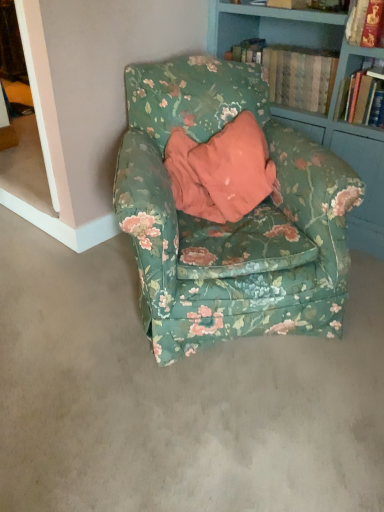
Question: Are hardcover book at upper right, marked as the first book in a left-to-right arrangement, and floral fabric armchair at center located far from each other?

Choices:
 (A) yes
 (B) no

Answer: (B)

Question: Can you confirm if hardcover book at upper right, the 2th book from the right, is thinner than floral fabric armchair at center?

Choices:
 (A) yes
 (B) no

Answer: (A)

Question: Is hardcover book at upper right, the 2th book from the right, oriented towards floral fabric armchair at center?

Choices:
 (A) no
 (B) yes

Answer: (B)

Question: Is hardcover book at upper right, marked as the first book in a left-to-right arrangement, closer to the viewer compared to floral fabric armchair at center?

Choices:
 (A) no
 (B) yes

Answer: (A)

Question: Can you confirm if hardcover book at upper right, the 2th book from the right, is smaller than floral fabric armchair at center?

Choices:
 (A) no
 (B) yes

Answer: (B)

Question: From a real-world perspective, relative to hardcover book at upper right, placed as the 1th book when sorted from right to left, is hardcover book at upper right, marked as the first book in a left-to-right arrangement, vertically above or below?

Choices:
 (A) below
 (B) above

Answer: (A)

Question: Considering the positions of hardcover book at upper right, the 2th book from the right, and hardcover book at upper right, the second book from the left, in the image, is hardcover book at upper right, the 2th book from the right, bigger or smaller than hardcover book at upper right, the second book from the left,?

Choices:
 (A) big
 (B) small

Answer: (A)

Question: Considering the positions of hardcover book at upper right, the 2th book from the right, and hardcover book at upper right, the second book from the left, in the image, is hardcover book at upper right, the 2th book from the right, taller or shorter than hardcover book at upper right, the second book from the left,?

Choices:
 (A) tall
 (B) short

Answer: (B)

Question: From the image's perspective, is hardcover book at upper right, the 2th book from the right, positioned above or below hardcover book at upper right, placed as the 1th book when sorted from right to left?

Choices:
 (A) above
 (B) below

Answer: (A)

Question: From the image's perspective, is floral fabric armchair at center positioned above or below floral fabric armchair at center?

Choices:
 (A) below
 (B) above

Answer: (A)

Question: Is floral fabric armchair at center situated inside floral fabric armchair at center or outside?

Choices:
 (A) outside
 (B) inside

Answer: (A)

Question: In terms of height, does floral fabric armchair at center look taller or shorter compared to floral fabric armchair at center?

Choices:
 (A) tall
 (B) short

Answer: (B)

Question: Is point (59, 320) closer or farther from the camera than point (339, 159)?

Choices:
 (A) closer
 (B) farther

Answer: (B)

Question: Considering their positions, is hardcover book at upper right, the second book from the left, located in front of or behind hardcover book at upper right, marked as the first book in a left-to-right arrangement?

Choices:
 (A) front
 (B) behind

Answer: (A)

Question: Would you say hardcover book at upper right, the second book from the left, is to the left or to the right of hardcover book at upper right, marked as the first book in a left-to-right arrangement, in the picture?

Choices:
 (A) left
 (B) right

Answer: (B)